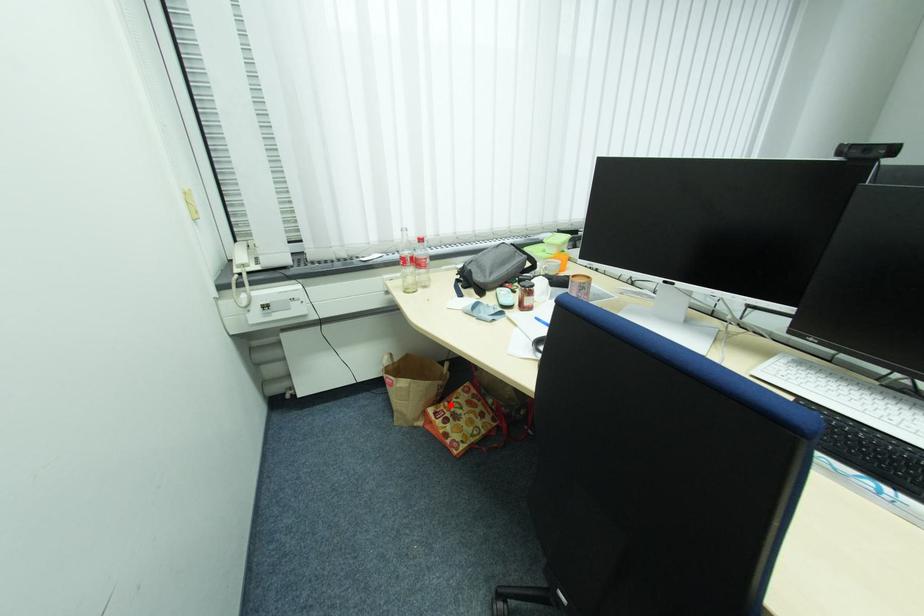
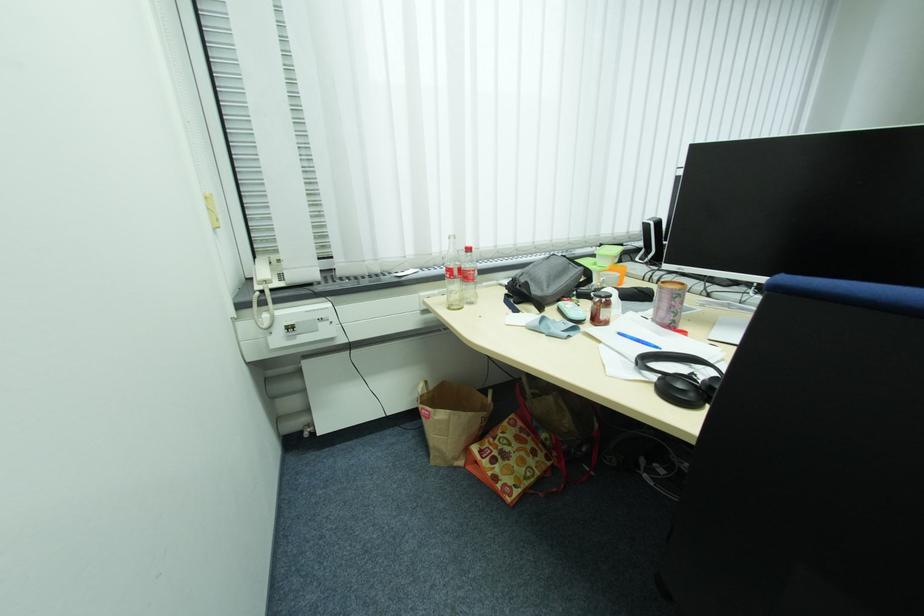
Question: I am providing you with two images of the same scene from different viewpoints. A red point is shown in image1. For the corresponding object point in image2, is it positioned nearer or farther from the camera?

Choices:
 (A) Nearer
 (B) Farther

Answer: (B)